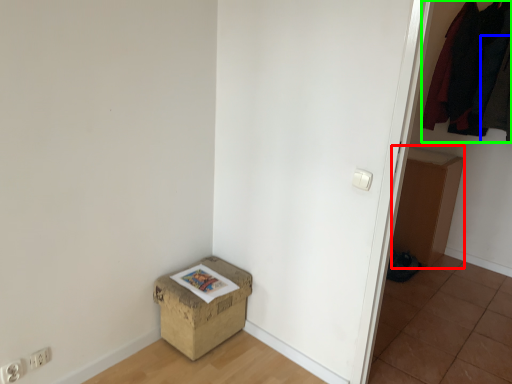
Question: Based on their relative distances, which object is farther from cardboard box (highlighted by a red box)? Choose from clothing (highlighted by a blue box) and clothing (highlighted by a green box).

Choices:
 (A) clothing
 (B) clothing

Answer: (A)